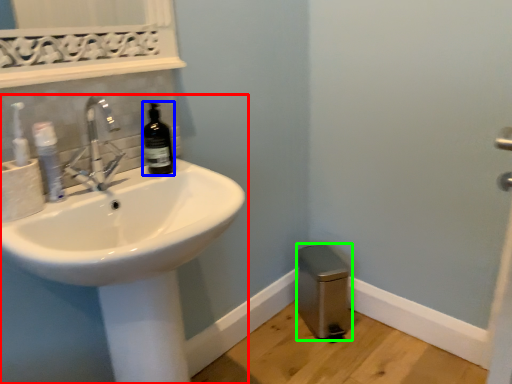
Question: Which is nearer to the sink (highlighted by a red box)? bottle (highlighted by a blue box) or bidet (highlighted by a green box).

Choices:
 (A) bottle
 (B) bidet

Answer: (A)